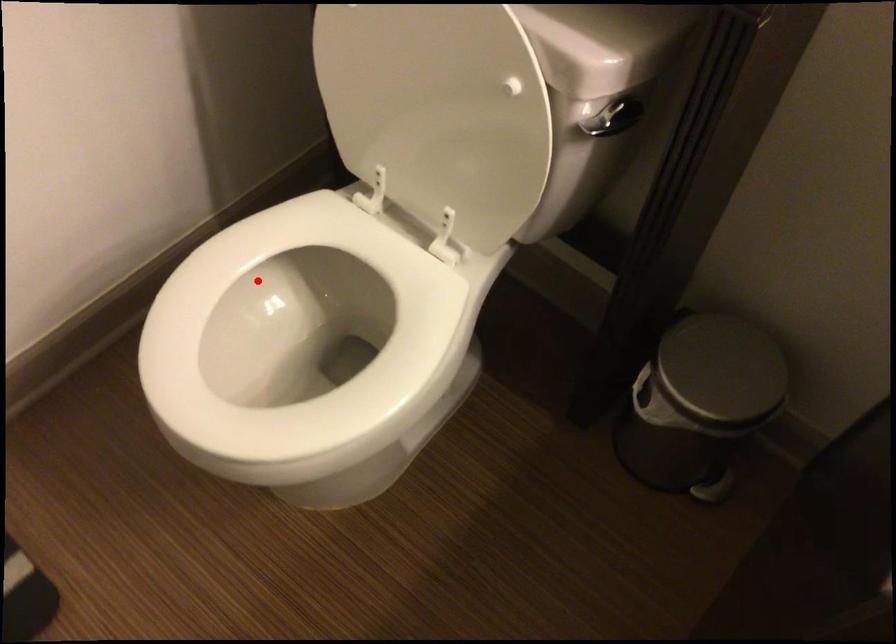
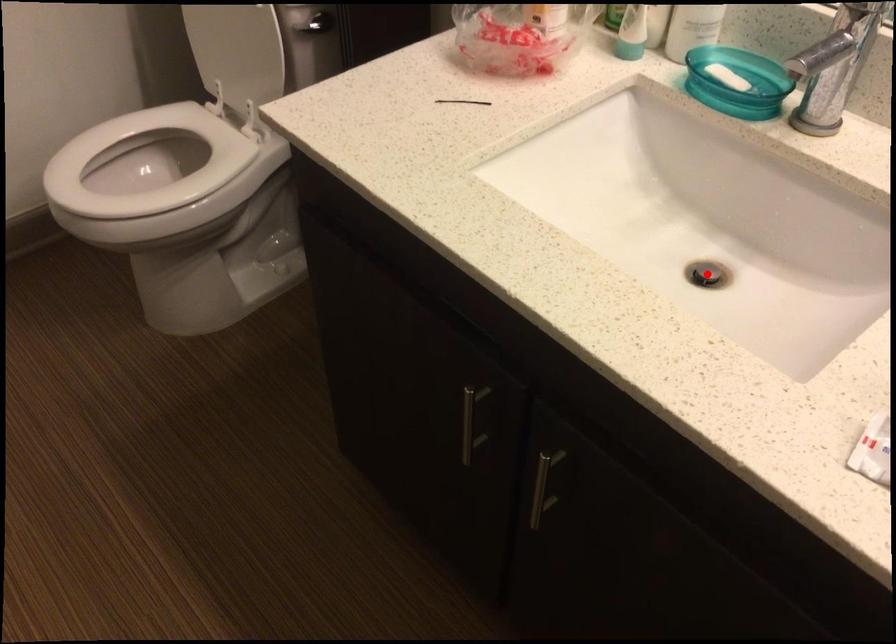
I am providing you with two images of the same scene from different viewpoints. A red point is marked on the first image and another point is marked on the second image. Do the highlighted points in image1 and image2 indicate the same real-world spot?

No